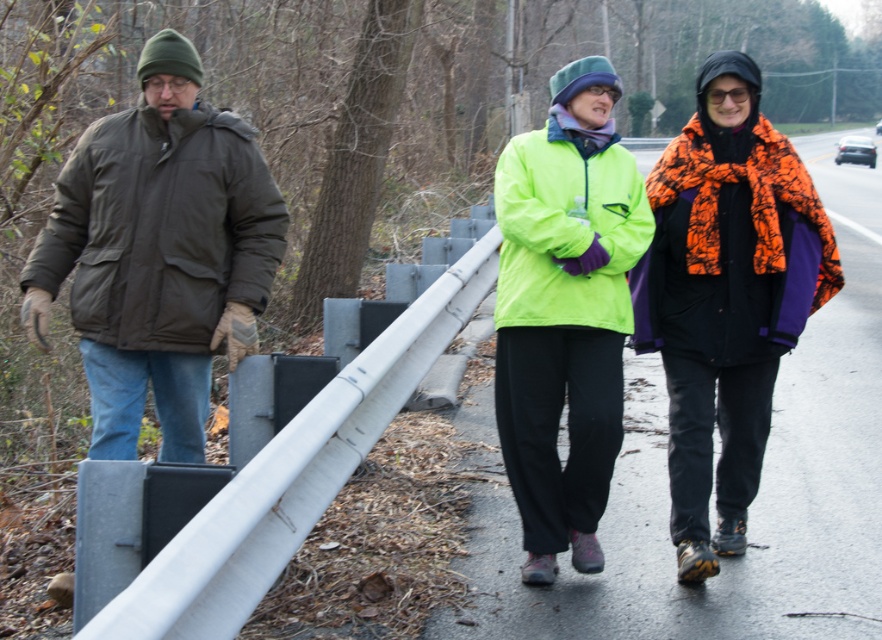
Question: Does orange camouflage jacket at right appear under neon green fabric jacket at center?

Choices:
 (A) yes
 (B) no

Answer: (A)

Question: Based on their relative distances, which object is farther from the neon yellow jacket at center?

Choices:
 (A) dark green puffy jacket at left
 (B) orange camouflage jacket at right
 (C) neon green jacket at center

Answer: (A)

Question: Is neon yellow jacket at center to the right of dark green puffy jacket at left from the viewer's perspective?

Choices:
 (A) no
 (B) yes

Answer: (B)

Question: Can you confirm if neon yellow jacket at center is smaller than neon green jacket at center?

Choices:
 (A) no
 (B) yes

Answer: (A)

Question: Which point appears farthest from the camera in this image?

Choices:
 (A) (202, 147)
 (B) (716, 177)

Answer: (B)

Question: Which point is closer to the camera taking this photo?

Choices:
 (A) (796, 291)
 (B) (547, 221)

Answer: (B)